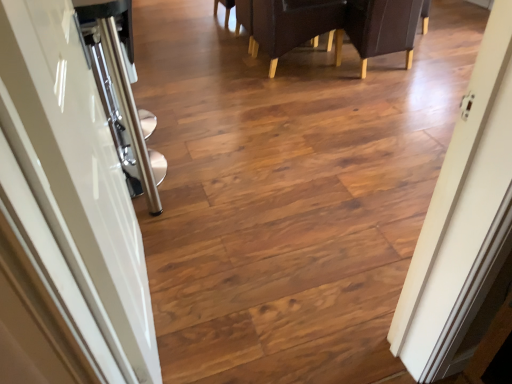
Locate an element on the screen. The height and width of the screenshot is (384, 512). vacant space in front of dark brown leather armchair at upper right, the second armchair from the left is located at coordinates (384, 96).